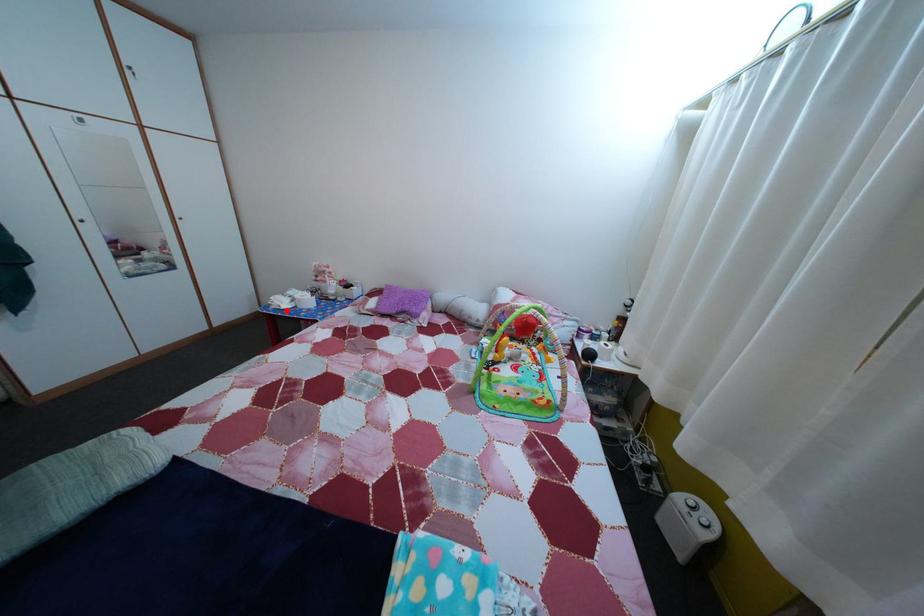
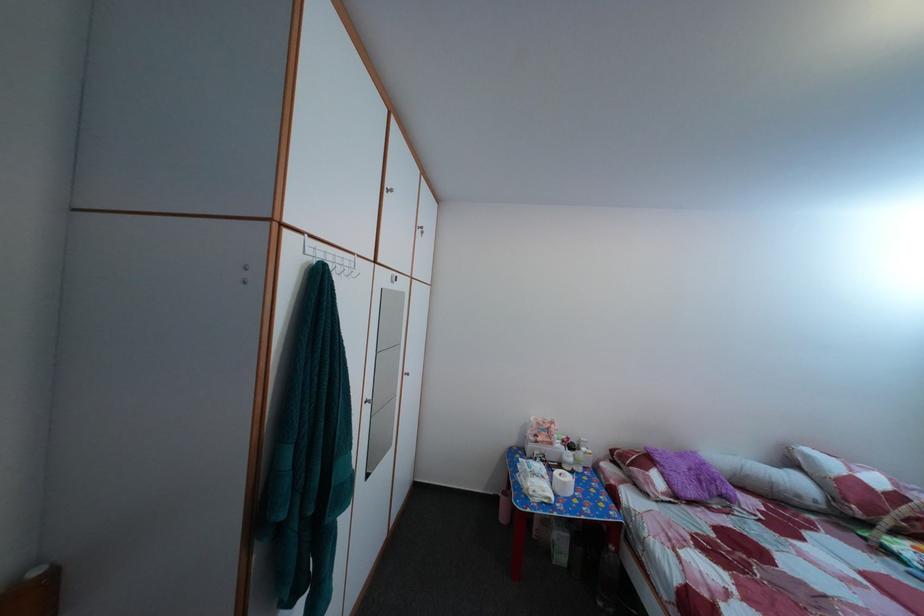
Locate, in the second image, the point that corresponds to the highlighted location in the first image.

(551, 500)